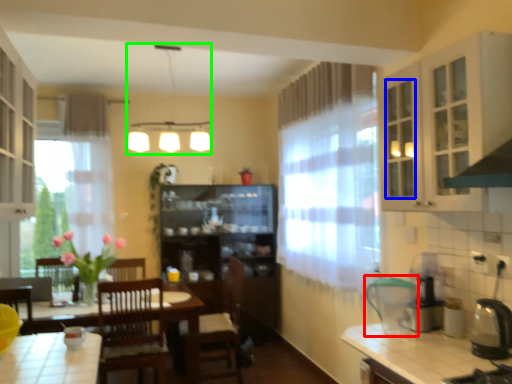
Question: Considering the real-world distances, which object is farthest from appliance (highlighted by a red box)? glass door (highlighted by a blue box) or light fixture (highlighted by a green box)?

Choices:
 (A) glass door
 (B) light fixture

Answer: (B)